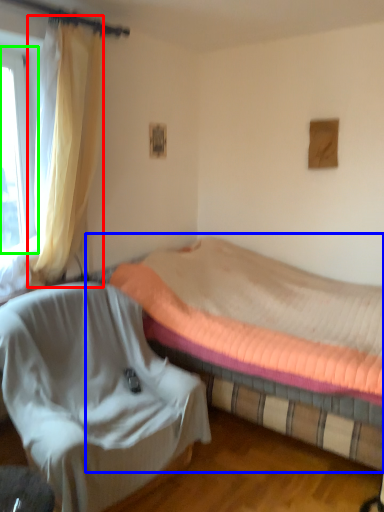
Question: Which is nearer to the curtain (highlighted by a red box)? bed (highlighted by a blue box) or window (highlighted by a green box).

Choices:
 (A) bed
 (B) window

Answer: (B)